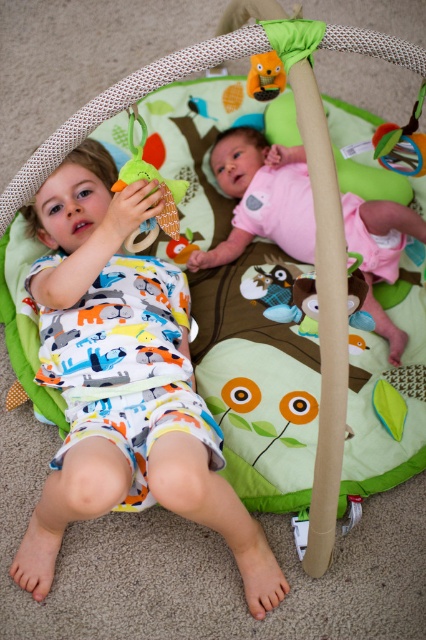
You are a parent trying to choose between two items for your child. You have the white cotton pajamas at left and the matte orange plush toy at upper center. If you want to give your child something wider, which item should you choose?

The white cotton pajamas at left are wider than the matte orange plush toy at upper center, so you should choose the white cotton pajamas at left.